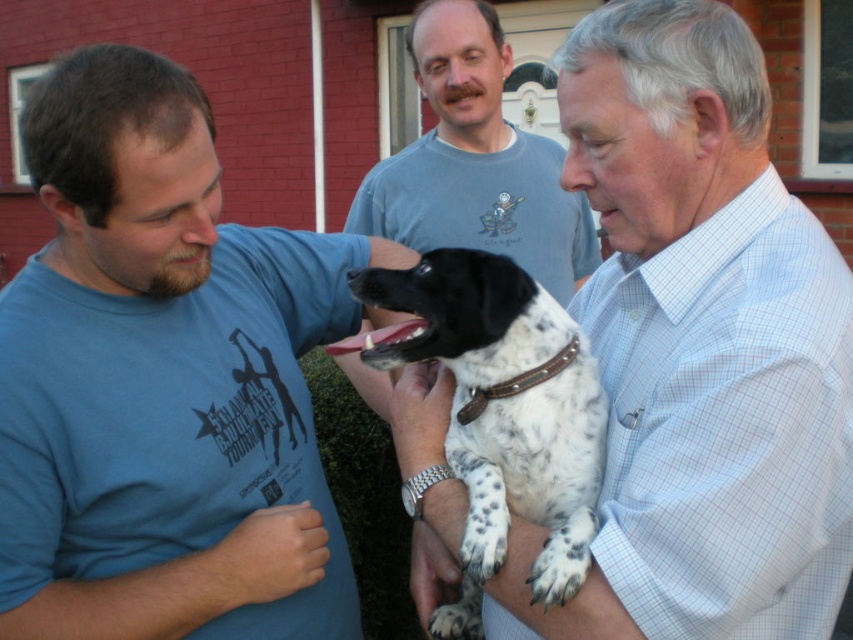
Question: Among these objects, which one is nearest to the camera?

Choices:
 (A) white checkered shirt at upper right
 (B) spotted fur dog at center

Answer: (A)

Question: Which object is closer to the camera taking this photo?

Choices:
 (A) spotted fur dog at center
 (B) blue t-shirt at left

Answer: (A)

Question: Does white checkered shirt at upper right have a smaller size compared to spotted fur dog at center?

Choices:
 (A) no
 (B) yes

Answer: (A)

Question: Among these objects, which one is nearest to the camera?

Choices:
 (A) blue t-shirt at left
 (B) white checkered shirt at upper right

Answer: (B)

Question: Does blue t-shirt at left have a smaller size compared to spotted fur dog at center?

Choices:
 (A) no
 (B) yes

Answer: (A)

Question: Does blue t-shirt at left have a lesser width compared to spotted fur dog at center?

Choices:
 (A) yes
 (B) no

Answer: (B)